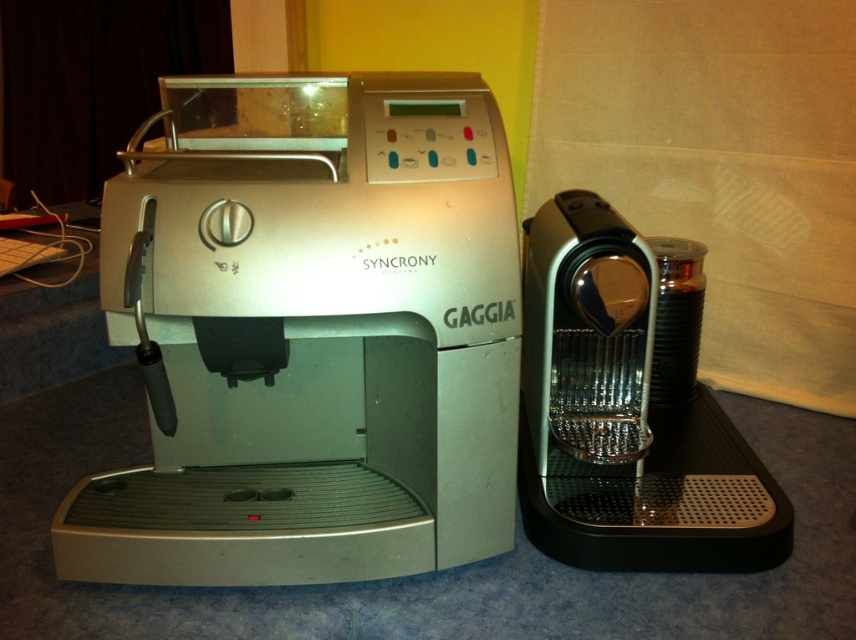
Question: Is silver metallic espresso machine at left wider than metallic silver coffee machine at right?

Choices:
 (A) no
 (B) yes

Answer: (B)

Question: Does silver metallic espresso machine at left appear under metallic silver coffee machine at right?

Choices:
 (A) no
 (B) yes

Answer: (A)

Question: Is the position of silver metallic espresso machine at left less distant than that of metallic silver coffee machine at right?

Choices:
 (A) yes
 (B) no

Answer: (A)

Question: Which point is closer to the camera?

Choices:
 (A) silver metallic espresso machine at left
 (B) metallic silver coffee machine at right

Answer: (A)

Question: Among these points, which one is nearest to the camera?

Choices:
 (A) (389, 371)
 (B) (593, 202)

Answer: (A)

Question: Which point is closer to the camera?

Choices:
 (A) (525, 532)
 (B) (209, 138)

Answer: (A)